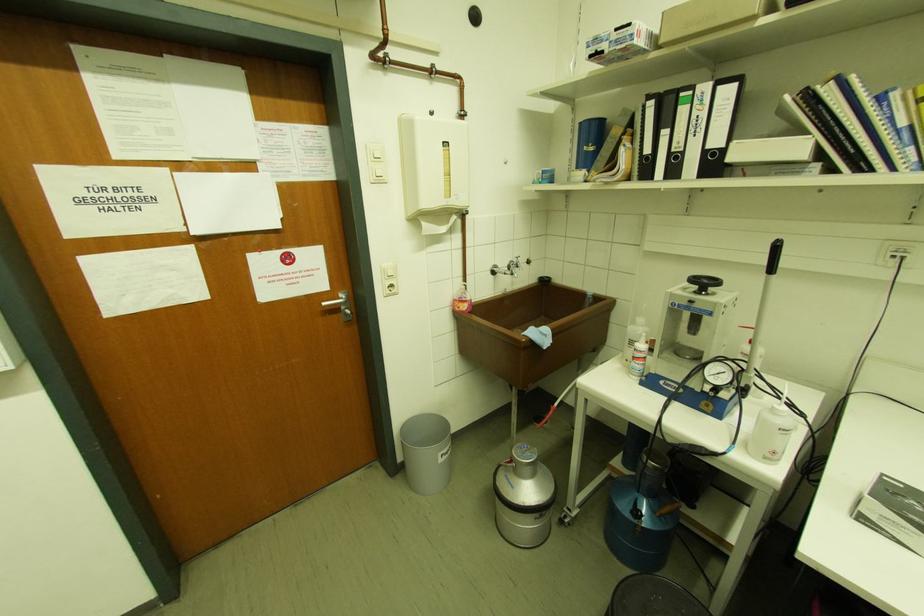
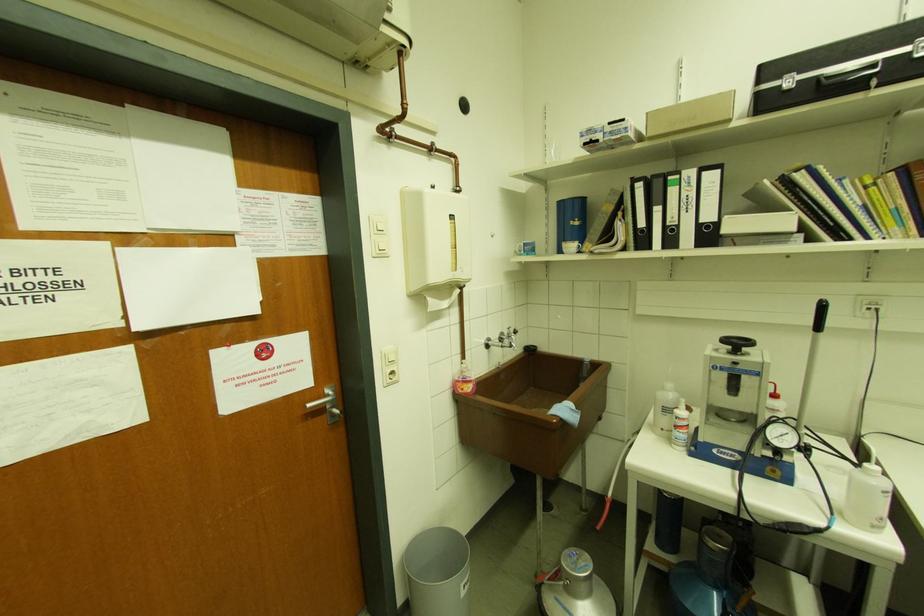
The point at (647, 342) is marked in the first image. Where is the corresponding point in the second image?

(687, 408)